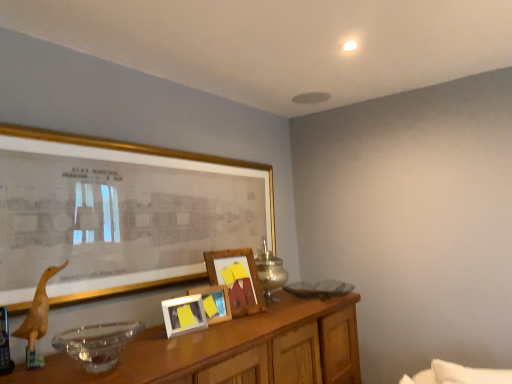
Question: Is matte gold picture frame at upper left, which ranks as the 4th picture frame in back-to-front order, far away from metallic silver table lamp at center?

Choices:
 (A) no
 (B) yes

Answer: (A)

Question: From a real-world perspective, is matte gold picture frame at upper left, placed as the 1th picture frame when sorted from front to back, positioned over metallic silver table lamp at center based on gravity?

Choices:
 (A) yes
 (B) no

Answer: (A)

Question: Is matte gold picture frame at upper left, placed as the 1th picture frame when sorted from front to back, positioned beyond the bounds of metallic silver table lamp at center?

Choices:
 (A) no
 (B) yes

Answer: (B)

Question: Can you confirm if matte gold picture frame at upper left, which ranks as the 4th picture frame in back-to-front order, is taller than metallic silver table lamp at center?

Choices:
 (A) no
 (B) yes

Answer: (B)

Question: Is matte gold picture frame at upper left, placed as the 1th picture frame when sorted from front to back, facing towards metallic silver table lamp at center?

Choices:
 (A) yes
 (B) no

Answer: (A)

Question: Is matte wooden picture frame at center, which is the second picture frame in front-to-back order, bigger or smaller than metallic silver table lamp at center?

Choices:
 (A) big
 (B) small

Answer: (B)

Question: Is matte wooden picture frame at center, which is counted as the 3th picture frame, starting from the back, taller or shorter than metallic silver table lamp at center?

Choices:
 (A) short
 (B) tall

Answer: (A)

Question: Based on their positions, is matte wooden picture frame at center, which is the second picture frame in front-to-back order, located to the left or right of metallic silver table lamp at center?

Choices:
 (A) left
 (B) right

Answer: (A)

Question: In the image, is matte wooden picture frame at center, which is counted as the 3th picture frame, starting from the back, positioned in front of or behind metallic silver table lamp at center?

Choices:
 (A) behind
 (B) front

Answer: (B)

Question: Is wooden picture frame at center, acting as the 4th picture frame starting from the front, bigger or smaller than metallic silver table lamp at center?

Choices:
 (A) small
 (B) big

Answer: (A)

Question: In terms of width, does wooden picture frame at center, positioned as the first picture frame in back-to-front order, look wider or thinner when compared to metallic silver table lamp at center?

Choices:
 (A) thin
 (B) wide

Answer: (A)

Question: Considering their positions, is wooden picture frame at center, acting as the 4th picture frame starting from the front, located in front of or behind metallic silver table lamp at center?

Choices:
 (A) behind
 (B) front

Answer: (B)

Question: Is wooden picture frame at center, acting as the 4th picture frame starting from the front, inside the boundaries of metallic silver table lamp at center, or outside?

Choices:
 (A) outside
 (B) inside

Answer: (A)

Question: Does point (260, 263) appear closer or farther from the camera than point (30, 332)?

Choices:
 (A) farther
 (B) closer

Answer: (A)

Question: Which is correct: metallic silver table lamp at center is inside wooden duckling at left, or outside of it?

Choices:
 (A) outside
 (B) inside

Answer: (A)